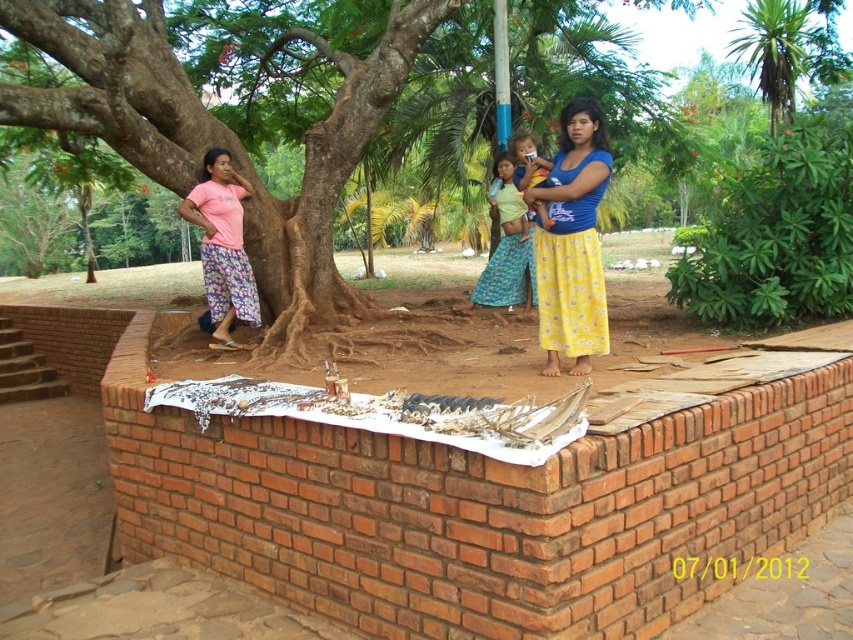
You are standing at the center of the brick structure with the white cloth. Looking towards the upper left corner of the image, what object would you see at point coordinates (219, 132)?

At point coordinates (219, 132), you would see the brown rough tree at upper left.

You are planning to set up a picnic area near the brown rough tree at upper left and the yellow fabric at center. Which object should you avoid placing your picnic blanket under to keep it from being overshadowed by the tree?

You should avoid placing your picnic blanket under the brown rough tree at upper left because it has a larger size compared to the yellow fabric at center, which means it will cast a bigger shadow.